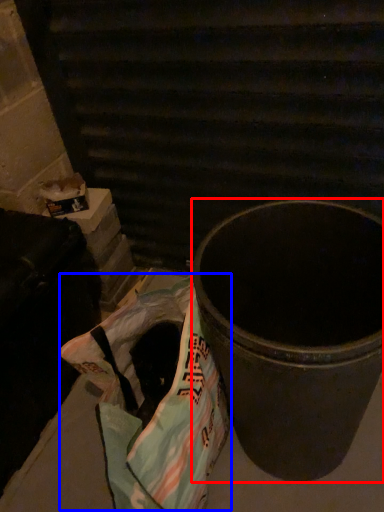
Question: Which object appears closest to the camera in this image, waste container (highlighted by a red box) or grocery bag (highlighted by a blue box)?

Choices:
 (A) waste container
 (B) grocery bag

Answer: (A)